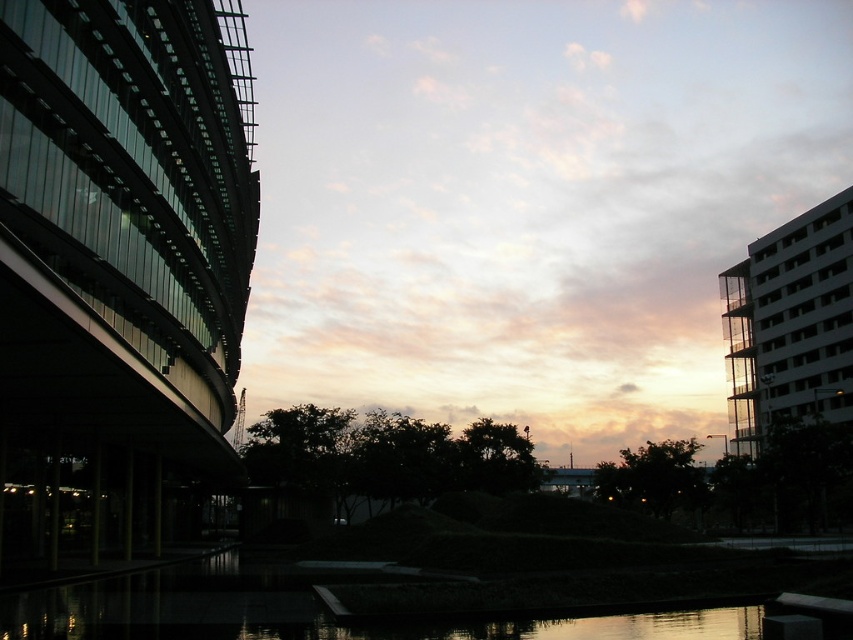
Question: Does pastel sky at center have a lesser width compared to black reflective water at center?

Choices:
 (A) yes
 (B) no

Answer: (B)

Question: Which of the following is the farthest from the observer?

Choices:
 (A) pastel sky at center
 (B) black reflective water at center

Answer: (A)

Question: Which object is farther from the camera taking this photo?

Choices:
 (A) black reflective water at center
 (B) pastel sky at center

Answer: (B)

Question: Is pastel sky at center further to camera compared to black reflective water at center?

Choices:
 (A) no
 (B) yes

Answer: (B)

Question: Considering the relative positions of pastel sky at center and black reflective water at center in the image provided, where is pastel sky at center located with respect to black reflective water at center?

Choices:
 (A) right
 (B) left

Answer: (A)